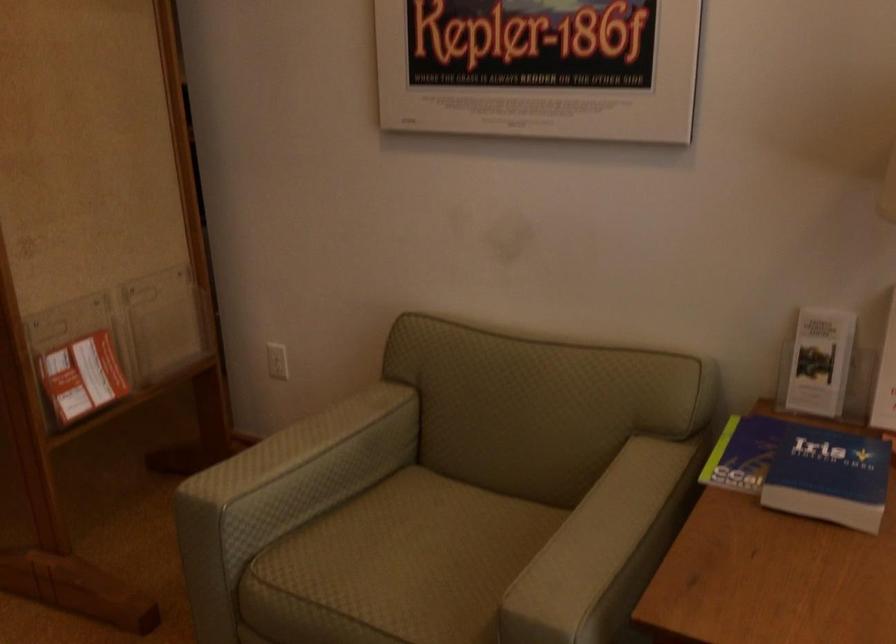
What do you see at coordinates (829, 476) in the screenshot?
I see `a blue book` at bounding box center [829, 476].